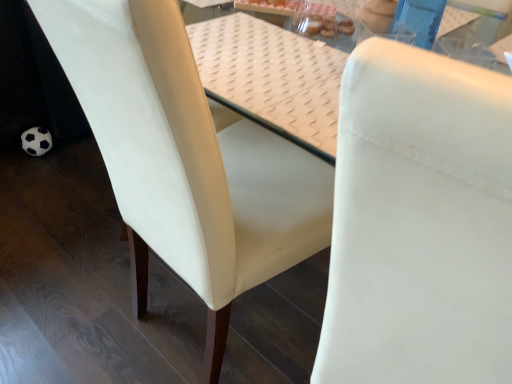
Question: Can white leather chair at center, the second chair positioned from the left, be found inside white textured table at center?

Choices:
 (A) no
 (B) yes

Answer: (A)

Question: Is white textured table at center taller than white leather chair at center, which is the 1th chair in right-to-left order?

Choices:
 (A) yes
 (B) no

Answer: (B)

Question: Is white textured table at center with white leather chair at center, which is the 1th chair in right-to-left order?

Choices:
 (A) no
 (B) yes

Answer: (A)

Question: From a real-world perspective, is white textured table at center physically below white leather chair at center, which is the 1th chair in right-to-left order?

Choices:
 (A) yes
 (B) no

Answer: (B)

Question: Is the depth of white textured table at center greater than that of white leather chair at center, the second chair positioned from the left?

Choices:
 (A) yes
 (B) no

Answer: (A)

Question: Looking at their shapes, would you say white leather chair at center, which is the 1th chair in right-to-left order, is wider or thinner than white textured table at center?

Choices:
 (A) thin
 (B) wide

Answer: (B)

Question: From a real-world perspective, relative to white textured table at center, is white leather chair at center, which is the 1th chair in right-to-left order, vertically above or below?

Choices:
 (A) above
 (B) below

Answer: (B)

Question: Is white leather chair at center, which is the 1th chair in right-to-left order, spatially inside white textured table at center, or outside of it?

Choices:
 (A) outside
 (B) inside

Answer: (A)

Question: Is point (451, 142) closer or farther from the camera than point (333, 129)?

Choices:
 (A) closer
 (B) farther

Answer: (A)

Question: Do you think white textured table at center is within white leather chair at center, which is the 1th chair in right-to-left order, or outside of it?

Choices:
 (A) inside
 (B) outside

Answer: (B)

Question: Is white textured table at center wider or thinner than white leather chair at center, the second chair positioned from the left?

Choices:
 (A) thin
 (B) wide

Answer: (A)

Question: From a real-world perspective, is white textured table at center positioned above or below white leather chair at center, the second chair positioned from the left?

Choices:
 (A) below
 (B) above

Answer: (B)

Question: In the image, is white textured table at center positioned in front of or behind white leather chair at center, the second chair positioned from the left?

Choices:
 (A) behind
 (B) front

Answer: (A)

Question: Considering the positions of white textured table at center and white leather chair at center, placed as the 2th chair when sorted from right to left, in the image, is white textured table at center wider or thinner than white leather chair at center, placed as the 2th chair when sorted from right to left,?

Choices:
 (A) thin
 (B) wide

Answer: (A)

Question: Choose the correct answer: Is white textured table at center inside white leather chair at center, acting as the 1th chair starting from the left, or outside it?

Choices:
 (A) outside
 (B) inside

Answer: (B)